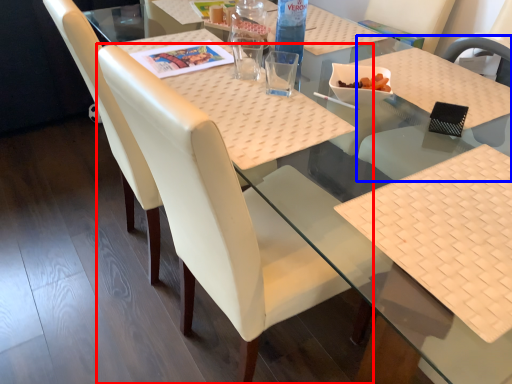
Question: Which object appears closest to the camera in this image, chair (highlighted by a red box) or chair (highlighted by a blue box)?

Choices:
 (A) chair
 (B) chair

Answer: (A)